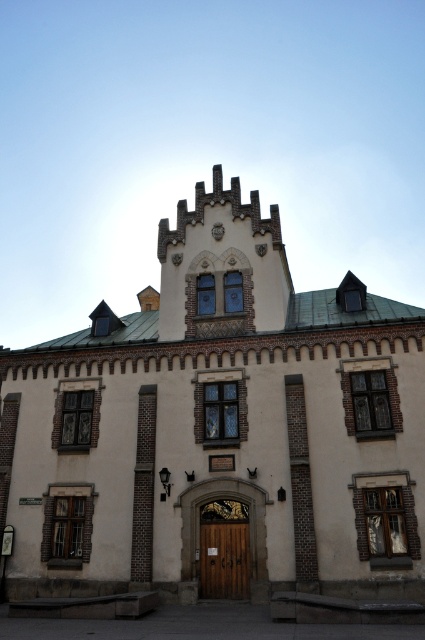
Question: Is beige stone church at center to the right of wooden door at center from the viewer's perspective?

Choices:
 (A) no
 (B) yes

Answer: (A)

Question: In this image, where is beige stone church at center located relative to wooden door at center?

Choices:
 (A) left
 (B) right

Answer: (A)

Question: Does beige stone church at center appear under wooden door at center?

Choices:
 (A) no
 (B) yes

Answer: (A)

Question: Which object appears closest to the camera in this image?

Choices:
 (A) beige stone church at center
 (B) wooden door at center

Answer: (A)

Question: Which point is closer to the camera taking this photo?

Choices:
 (A) click(x=215, y=504)
 (B) click(x=189, y=560)

Answer: (B)